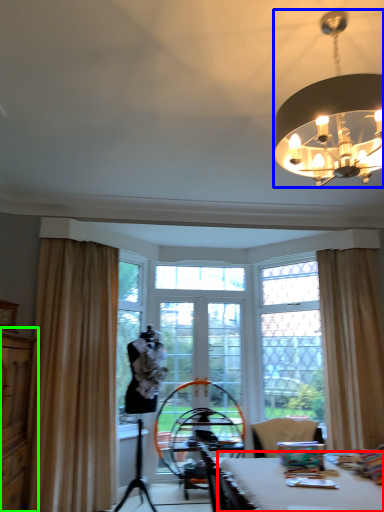
Question: Estimate the real-world distances between objects in this image. Which object is farther from table (highlighted by a red box), lamp (highlighted by a blue box) or dresser (highlighted by a green box)?

Choices:
 (A) lamp
 (B) dresser

Answer: (B)